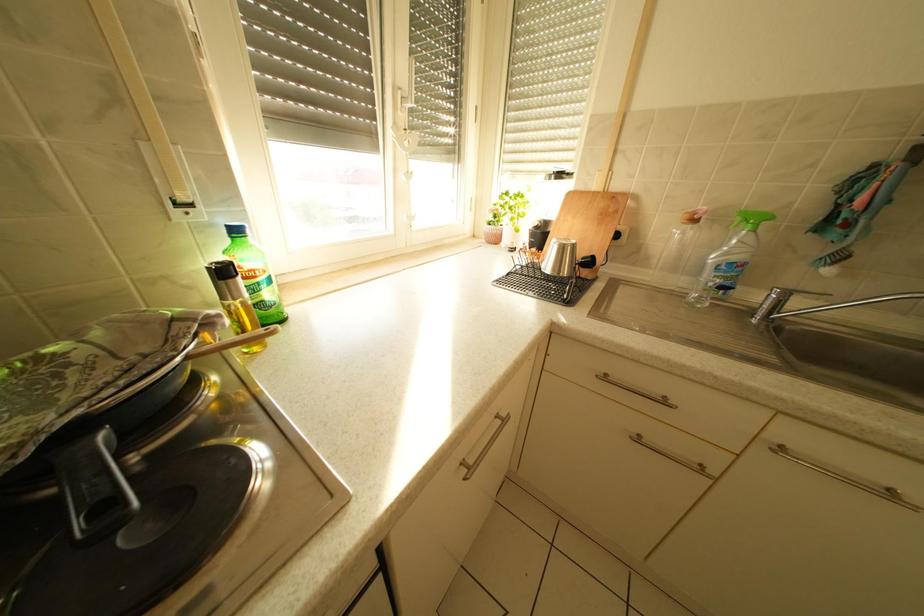
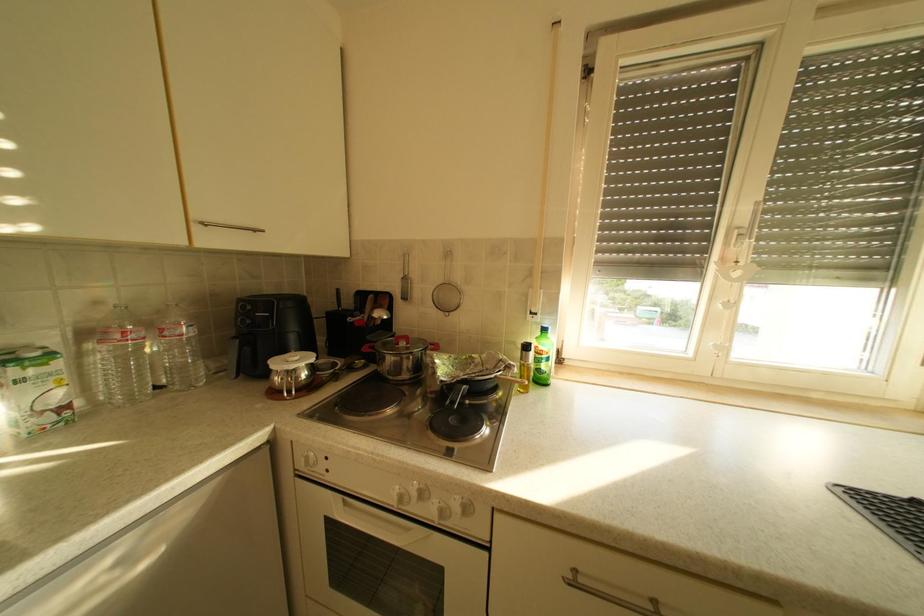
Question: The camera is either moving clockwise (left) or counter-clockwise (right) around the object. The first image is from the beginning of the video and the second image is from the end. Is the camera moving left or right when shooting the video?

Choices:
 (A) Left
 (B) Right

Answer: (B)